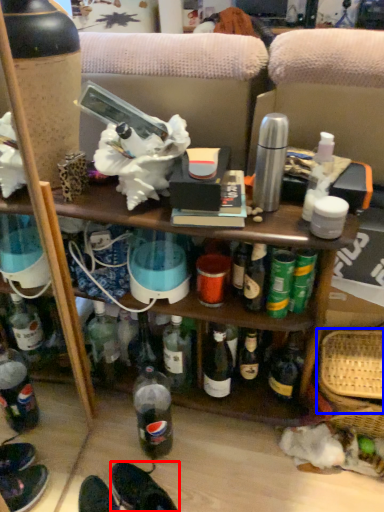
Question: Which object appears farthest to the camera in this image, footwear (highlighted by a red box) or basket (highlighted by a blue box)?

Choices:
 (A) footwear
 (B) basket

Answer: (B)